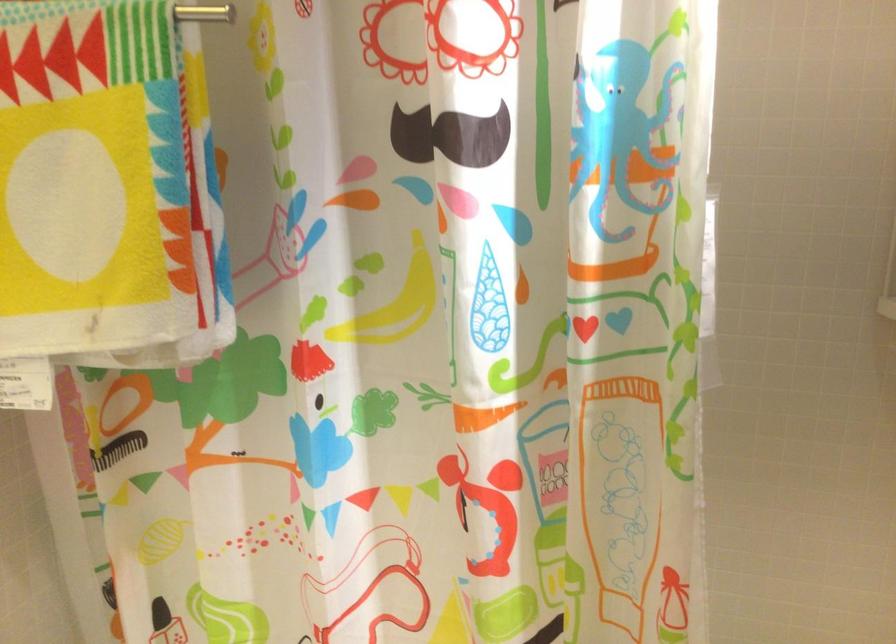
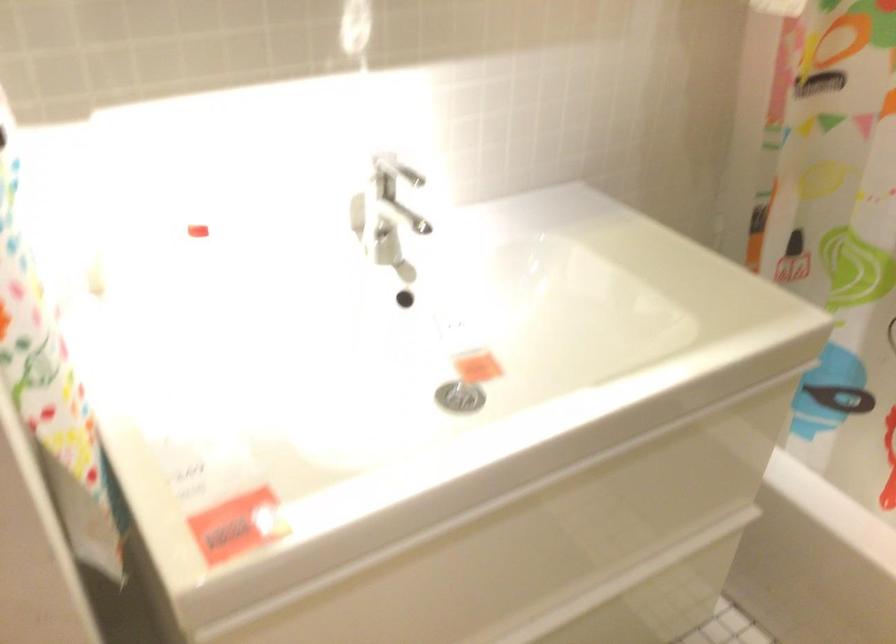
Based on the continuous images, in which direction is the camera rotating?

The camera's rotation is toward left-down.